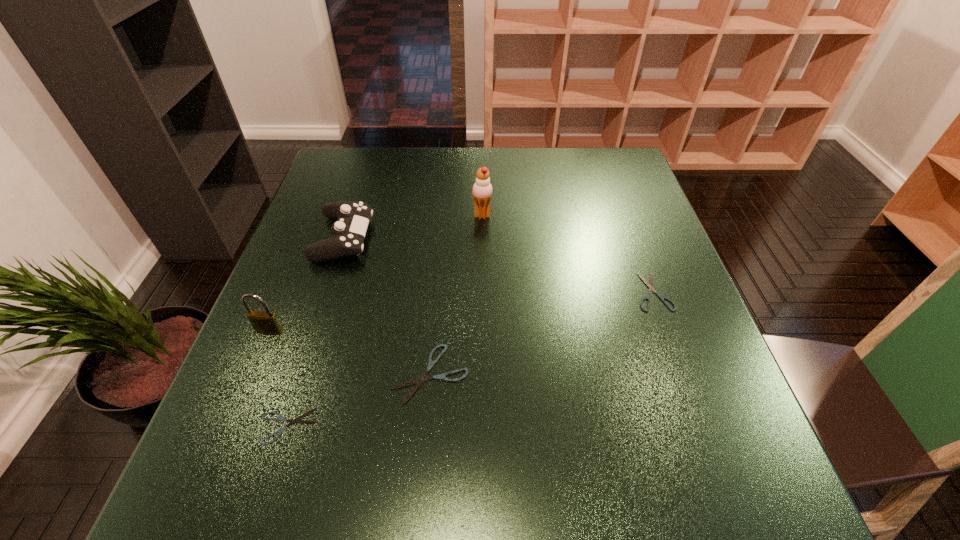
Identify the location of the third closest object relative to the fifth shortest object. (419, 381).

Locate which object is the fifth closest to the rightmost object. Please provide its 2D coordinates. Your answer should be formatted as a tuple, i.e. [(x, y)], where the tuple contains the x and y coordinates of a point satisfying the conditions above.

[(266, 322)]

Identify which shears is the third nearest to the control. Please provide its 2D coordinates. Your answer should be formatted as a tuple, i.e. [(x, y)], where the tuple contains the x and y coordinates of a point satisfying the conditions above.

[(650, 286)]

You are a GUI agent. You are given a task and a screenshot of the screen. Output one action in this format:
    pyautogui.click(x=<x>, y=<y>)
    Task: Click on the shears object that ranks as the closest to the fifth shortest object
    This screenshot has width=960, height=540.
    Given the screenshot: What is the action you would take?
    pyautogui.click(x=291, y=421)

I want to click on vacant space that satisfies the following two spatial constraints: 1. on the surface of the second shortest shears; 2. on the left side of the fourth shortest object, so click(x=325, y=292).

You are a GUI agent. You are given a task and a screenshot of the screen. Output one action in this format:
    pyautogui.click(x=<x>, y=<y>)
    Task: Click on the vacant area that satisfies the following two spatial constraints: 1. on the surface of the nearest object; 2. on the left side of the fourth shortest object
    This screenshot has height=540, width=960.
    Given the screenshot: What is the action you would take?
    pyautogui.click(x=281, y=427)

At what (x,y) coordinates should I click in order to perform the action: click on vacant space that satisfies the following two spatial constraints: 1. at the front with a straw on the second object from right to left; 2. on the front side of the padlock. Please return your answer as a coordinate pair (x, y). The width and height of the screenshot is (960, 540). Looking at the image, I should click on (483, 331).